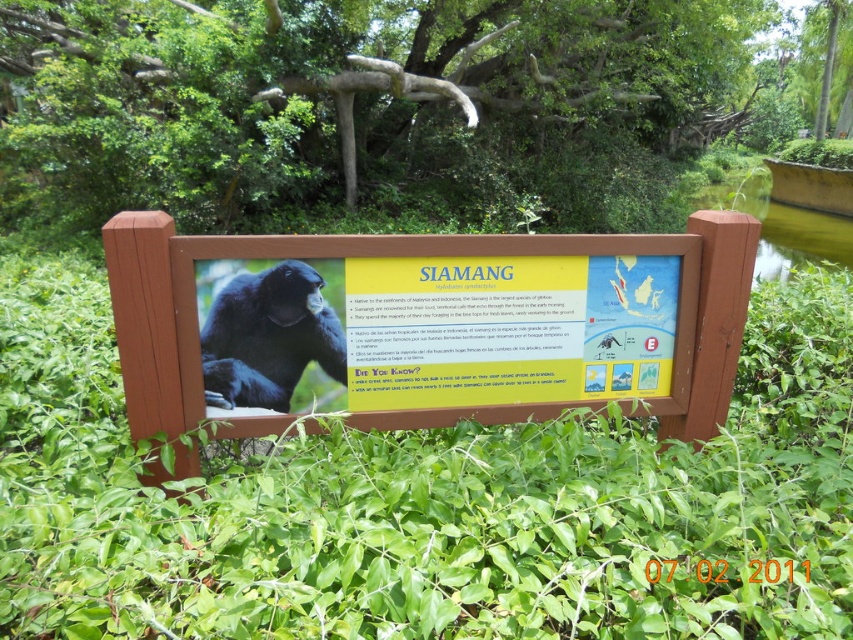
Is wooden signboard at center to the right of shiny black siamang at center from the viewer's perspective?

Yes, wooden signboard at center is to the right of shiny black siamang at center.

Does wooden signboard at center appear under shiny black siamang at center?

Indeed, wooden signboard at center is positioned under shiny black siamang at center.

You are a GUI agent. You are given a task and a screenshot of the screen. Output one action in this format:
    pyautogui.click(x=<x>, y=<y>)
    Task: Click on the wooden signboard at center
    The image size is (853, 640).
    Given the screenshot: What is the action you would take?
    pyautogui.click(x=444, y=324)

Is green leafy plant at center taller than shiny black siamang at center?

Yes.

Can you confirm if green leafy plant at center is bigger than shiny black siamang at center?

Correct, green leafy plant at center is larger in size than shiny black siamang at center.

I want to click on green leafy plant at center, so click(x=425, y=500).

You are a GUI agent. You are given a task and a screenshot of the screen. Output one action in this format:
    pyautogui.click(x=<x>, y=<y>)
    Task: Click on the green leafy plant at center
    
    Given the screenshot: What is the action you would take?
    coord(425,500)

Is green leafy plant at center shorter than wooden signboard at center?

No, green leafy plant at center is not shorter than wooden signboard at center.

Is green leafy plant at center above wooden signboard at center?

No, green leafy plant at center is not above wooden signboard at center.

Where is `green leafy plant at center`? This screenshot has width=853, height=640. green leafy plant at center is located at coordinates (425, 500).